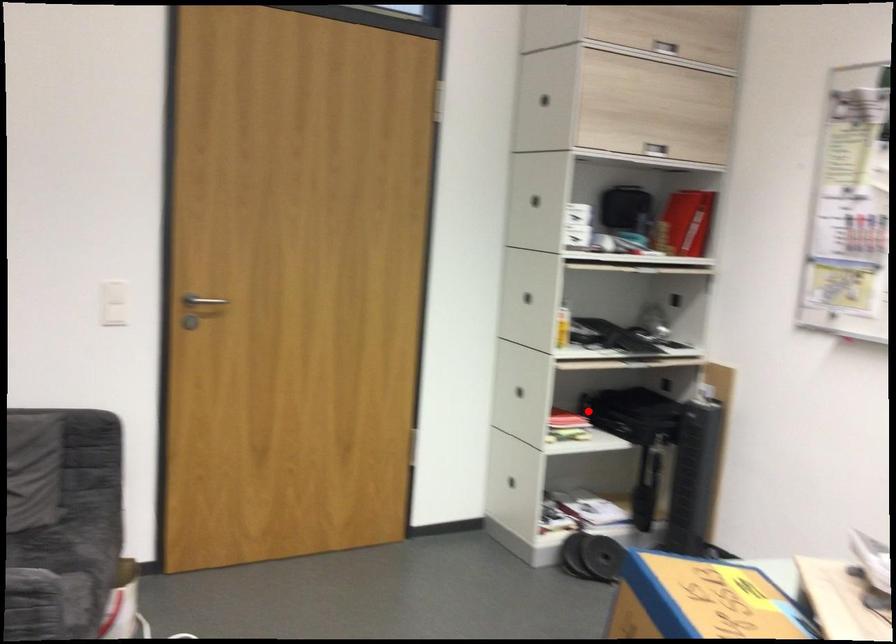
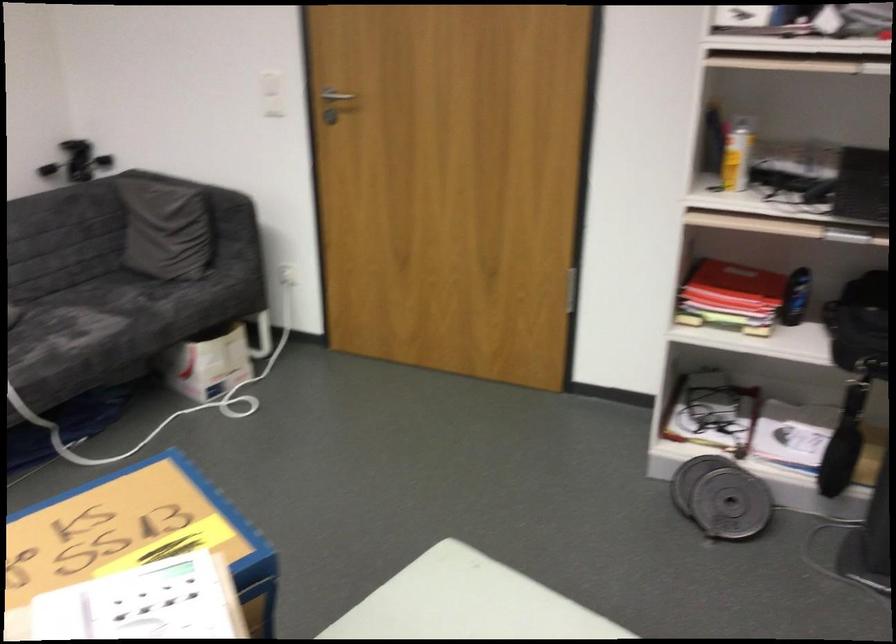
Locate, in the second image, the point that corresponds to the highlighted location in the first image.

(796, 297)